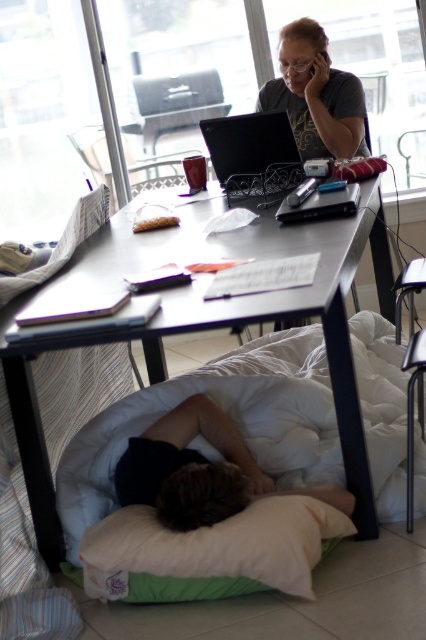
Between point (100, 564) and point (218, 422), which one is positioned in front?

Point (100, 564) is in front.

Where is `white soft bed at lower center`? white soft bed at lower center is located at coordinates (230, 518).

Find the location of `white soft bed at lower center`. white soft bed at lower center is located at coordinates (230, 518).

Does dark brown hair at lower center appear under black plastic phone at upper center?

Yes.

The height and width of the screenshot is (640, 426). What are the coordinates of `dark brown hair at lower center` in the screenshot? It's located at (199, 470).

Identify the location of dark brown hair at lower center. (199, 470).

Describe the element at coordinates (213, 326) in the screenshot. I see `matte black desk at center` at that location.

Can you confirm if matte black desk at center is positioned below dark brown hair at lower center?

No, matte black desk at center is not below dark brown hair at lower center.

Describe the element at coordinates (213, 326) in the screenshot. I see `matte black desk at center` at that location.

Where is `matte black desk at center`? matte black desk at center is located at coordinates pyautogui.click(x=213, y=326).